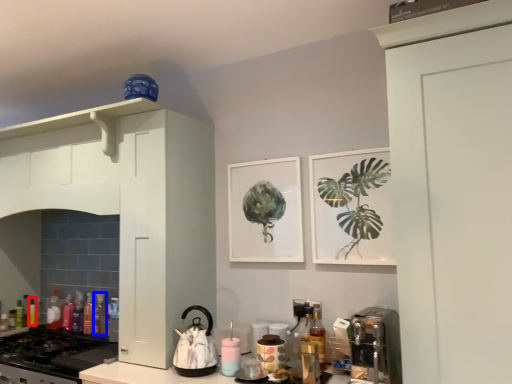
Question: Which object is further to the camera taking this photo, bottle (highlighted by a red box) or bottle (highlighted by a blue box)?

Choices:
 (A) bottle
 (B) bottle

Answer: (A)